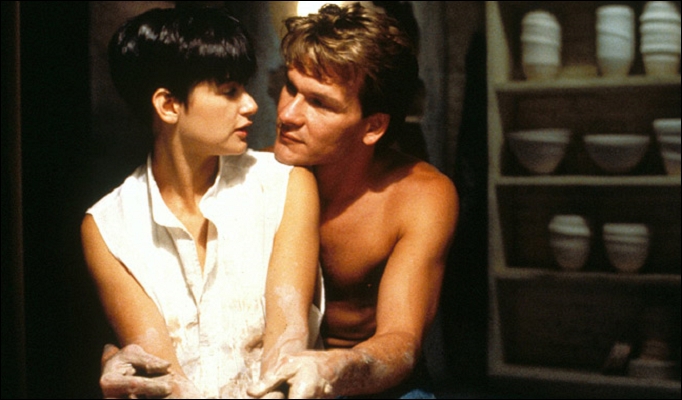
Where is `stack of pottery`? stack of pottery is located at coordinates (533, 51), (612, 21), (668, 148), (531, 151), (572, 238), (621, 233), (622, 134).